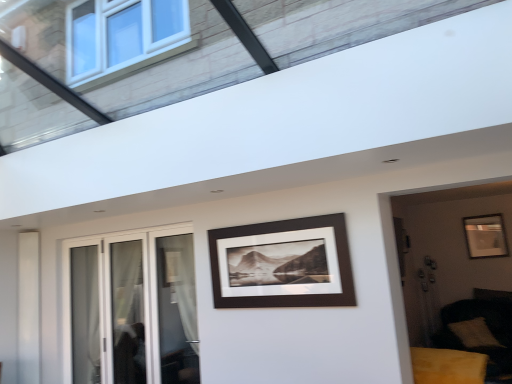
What is the approximate width of soft beige cushion at lower right?

soft beige cushion at lower right is 40.35 centimeters wide.

What do you see at coordinates (284, 263) in the screenshot? This screenshot has height=384, width=512. I see `matte black picture frame at center, acting as the 2th picture frame starting from the back` at bounding box center [284, 263].

This screenshot has width=512, height=384. What do you see at coordinates (485, 236) in the screenshot?
I see `matte black picture frame at right, marked as the first picture frame in a back-to-front arrangement` at bounding box center [485, 236].

Find the location of a particular element. The image size is (512, 384). soft beige cushion at lower right is located at coordinates (474, 333).

Is yellow velvet sofa at lower right in front of or behind matte black picture frame at center, the 1th picture frame from the left, in the image?

In the image, yellow velvet sofa at lower right appears in front of matte black picture frame at center, the 1th picture frame from the left.

From the image's perspective, does yellow velvet sofa at lower right appear higher than matte black picture frame at center, which is counted as the 2th picture frame, starting from the right?

No, from the image's perspective, yellow velvet sofa at lower right is not over matte black picture frame at center, which is counted as the 2th picture frame, starting from the right.

Between point (437, 365) and point (336, 266), which one is positioned in front?

The point (336, 266) is in front.

Between yellow velvet sofa at lower right and matte black picture frame at center, acting as the 2th picture frame starting from the back, which one appears on the left side from the viewer's perspective?

matte black picture frame at center, acting as the 2th picture frame starting from the back.

From the image's perspective, relative to soft beige cushion at lower right, is yellow velvet sofa at lower right above or below?

Clearly, from the image's perspective, yellow velvet sofa at lower right is above soft beige cushion at lower right.

Is the depth of yellow velvet sofa at lower right less than that of soft beige cushion at lower right?

Yes, yellow velvet sofa at lower right is closer to the viewer.

Which object is positioned more to the right, yellow velvet sofa at lower right or soft beige cushion at lower right?

soft beige cushion at lower right.

Is yellow velvet sofa at lower right taller or shorter than soft beige cushion at lower right?

Clearly, yellow velvet sofa at lower right is shorter compared to soft beige cushion at lower right.

Considering the sizes of objects matte black picture frame at right, the 1th picture frame in the right-to-left sequence, and yellow velvet sofa at lower right in the image provided, who is thinner, matte black picture frame at right, the 1th picture frame in the right-to-left sequence, or yellow velvet sofa at lower right?

matte black picture frame at right, the 1th picture frame in the right-to-left sequence, is thinner.

Is matte black picture frame at right, placed as the 2th picture frame when sorted from front to back, at the right side of yellow velvet sofa at lower right?

Indeed, matte black picture frame at right, placed as the 2th picture frame when sorted from front to back, is positioned on the right side of yellow velvet sofa at lower right.

Locate an element on the screen. furniture below the matte black picture frame at right, placed as the 2th picture frame when sorted from front to back (from a real-world perspective) is located at coordinates (447, 366).

Find the location of a particular element. The image size is (512, 384). pillow that appears below the matte black picture frame at right, placed as the 2th picture frame when sorted from front to back (from a real-world perspective) is located at coordinates (474, 333).

From the image's perspective, relative to matte black picture frame at right, the 1th picture frame in the right-to-left sequence, is soft beige cushion at lower right above or below?

soft beige cushion at lower right is situated lower than matte black picture frame at right, the 1th picture frame in the right-to-left sequence, in the image.

From a real-world perspective, is soft beige cushion at lower right located higher than matte black picture frame at right, marked as the first picture frame in a back-to-front arrangement?

No, from a real-world perspective, soft beige cushion at lower right is not over matte black picture frame at right, marked as the first picture frame in a back-to-front arrangement

Which object is more forward, matte black picture frame at center, which ranks as the first picture frame in front-to-back order, or white glass door at left?

matte black picture frame at center, which ranks as the first picture frame in front-to-back order, is closer to the camera.

Is matte black picture frame at center, acting as the 2th picture frame starting from the back, touching white glass door at left?

No, matte black picture frame at center, acting as the 2th picture frame starting from the back, is not in contact with white glass door at left.

From the image's perspective, which is below, matte black picture frame at center, which is counted as the 2th picture frame, starting from the right, or white glass door at left?

white glass door at left.

Is matte black picture frame at right, marked as the first picture frame in a back-to-front arrangement, shorter than soft beige cushion at lower right?

In fact, matte black picture frame at right, marked as the first picture frame in a back-to-front arrangement, may be taller than soft beige cushion at lower right.

From the image's perspective, does matte black picture frame at right, the 1th picture frame in the right-to-left sequence, appear lower than soft beige cushion at lower right?

No.

From a real-world perspective, is matte black picture frame at right, the 1th picture frame in the right-to-left sequence, beneath soft beige cushion at lower right?

No, from a real-world perspective, matte black picture frame at right, the 1th picture frame in the right-to-left sequence, is not under soft beige cushion at lower right.

Between matte black picture frame at right, marked as the first picture frame in a back-to-front arrangement, and soft beige cushion at lower right, which one has smaller size?

matte black picture frame at right, marked as the first picture frame in a back-to-front arrangement.

Are white glass door at left and yellow velvet sofa at lower right beside each other?

No, white glass door at left is not touching yellow velvet sofa at lower right.

Which point is more forward, (149,244) or (474,366)?

The point (474,366) is closer.

Looking at this image, from the image's perspective, relative to yellow velvet sofa at lower right, is white glass door at left above or below?

white glass door at left is situated higher than yellow velvet sofa at lower right in the image.

Is white glass door at left surrounding yellow velvet sofa at lower right?

No, yellow velvet sofa at lower right is not a part of white glass door at left.

Image resolution: width=512 pixels, height=384 pixels. I want to click on the 1st picture frame behind the yellow velvet sofa at lower right, so click(x=284, y=263).

Locate an element on the screen. The image size is (512, 384). pillow on the right of the yellow velvet sofa at lower right is located at coordinates (474, 333).

When comparing their distances from matte black picture frame at right, which is the 2th picture frame from left to right, does white glass door at left or soft beige cushion at lower right seem further?

The object further to matte black picture frame at right, which is the 2th picture frame from left to right, is white glass door at left.

Based on their spatial positions, is matte black picture frame at right, placed as the 2th picture frame when sorted from front to back, or soft beige cushion at lower right closer to yellow velvet sofa at lower right?

soft beige cushion at lower right is closer to yellow velvet sofa at lower right.

From the image, which object appears to be nearer to soft beige cushion at lower right, matte black picture frame at center, which is counted as the 2th picture frame, starting from the right, or yellow velvet sofa at lower right?

Based on the image, yellow velvet sofa at lower right appears to be nearer to soft beige cushion at lower right.

When comparing their distances from matte black picture frame at center, the 1th picture frame from the left, does soft beige cushion at lower right or white glass door at left seem closer?

white glass door at left.

From the picture: Which object lies nearer to the anchor point matte black picture frame at right, which is the 2th picture frame from left to right, yellow velvet sofa at lower right or white glass door at left?

The object closer to matte black picture frame at right, which is the 2th picture frame from left to right, is yellow velvet sofa at lower right.

When comparing their distances from matte black picture frame at center, the 1th picture frame from the left, does yellow velvet sofa at lower right or matte black picture frame at right, marked as the first picture frame in a back-to-front arrangement, seem further?

matte black picture frame at right, marked as the first picture frame in a back-to-front arrangement, lies further to matte black picture frame at center, the 1th picture frame from the left, than the other object.

When comparing their distances from yellow velvet sofa at lower right, does white glass door at left or matte black picture frame at center, which is counted as the 2th picture frame, starting from the right, seem further?

white glass door at left.

From the image, which object appears to be nearer to yellow velvet sofa at lower right, matte black picture frame at right, which is the 2th picture frame from left to right, or white glass door at left?

Among the two, white glass door at left is located nearer to yellow velvet sofa at lower right.

You are a GUI agent. You are given a task and a screenshot of the screen. Output one action in this format:
    pyautogui.click(x=<x>, y=<y>)
    Task: Click on the furniture situated between white glass door at left and soft beige cushion at lower right from left to right
    This screenshot has width=512, height=384.
    Given the screenshot: What is the action you would take?
    pyautogui.click(x=447, y=366)

At what (x,y) coordinates should I click in order to perform the action: click on pillow between white glass door at left and matte black picture frame at right, the 1th picture frame in the right-to-left sequence, in the horizontal direction. Please return your answer as a coordinate pair (x, y). The height and width of the screenshot is (384, 512). Looking at the image, I should click on (474, 333).

You are a GUI agent. You are given a task and a screenshot of the screen. Output one action in this format:
    pyautogui.click(x=<x>, y=<y>)
    Task: Click on the picture frame between white glass door at left and yellow velvet sofa at lower right from left to right
    
    Given the screenshot: What is the action you would take?
    pyautogui.click(x=284, y=263)

The height and width of the screenshot is (384, 512). In order to click on picture frame between white glass door at left and matte black picture frame at right, the 1th picture frame in the right-to-left sequence, from left to right in this screenshot , I will do [284, 263].